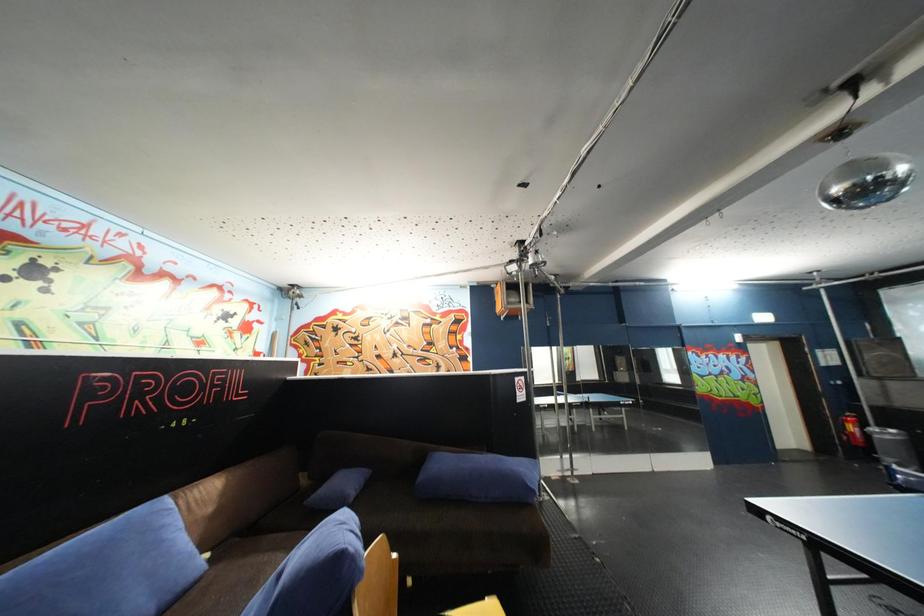
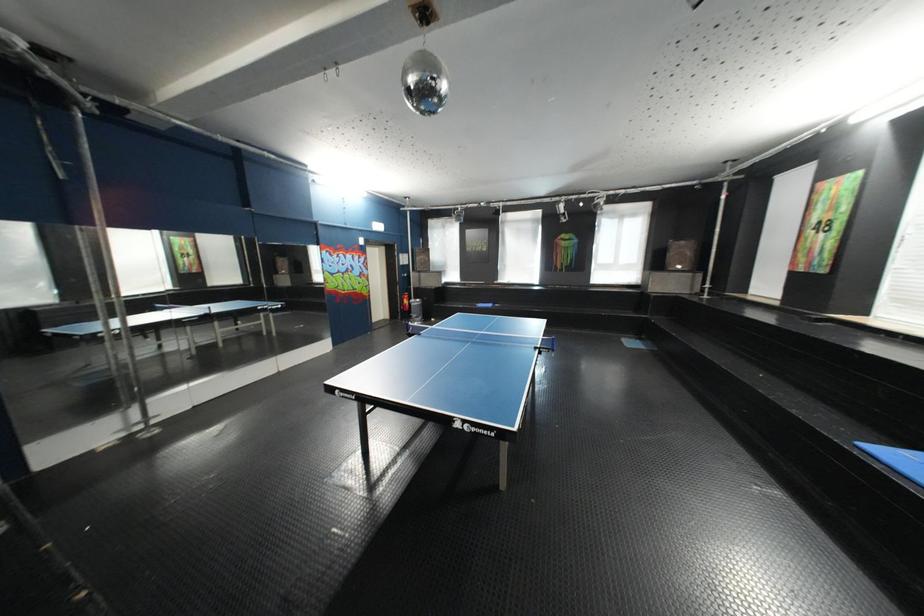
Question: How did the camera likely rotate?

Choices:
 (A) Left
 (B) Right
 (C) Up
 (D) Down

Answer: (B)